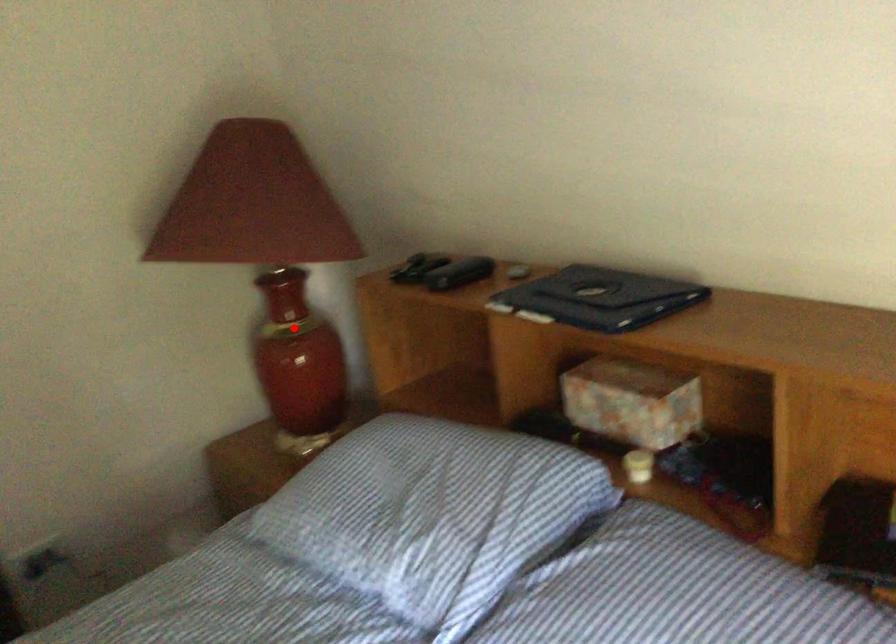
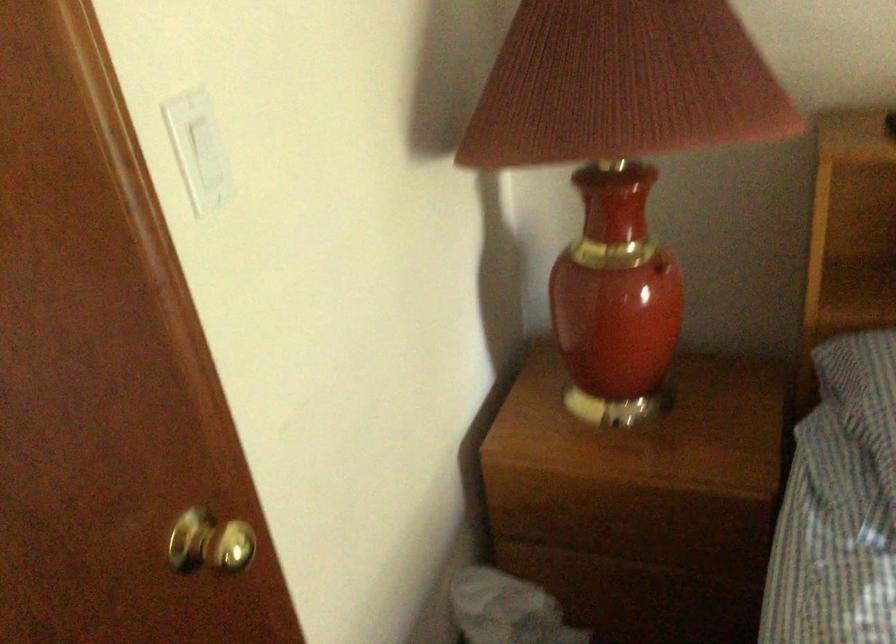
In the second image, find the point that corresponds to the highlighted location in the first image.

(661, 267)